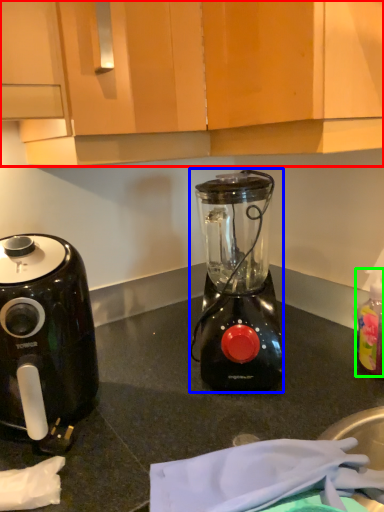
Question: Which is farther away from cabinetry (highlighted by a red box)? blender (highlighted by a blue box) or bottle (highlighted by a green box)?

Choices:
 (A) blender
 (B) bottle

Answer: (B)